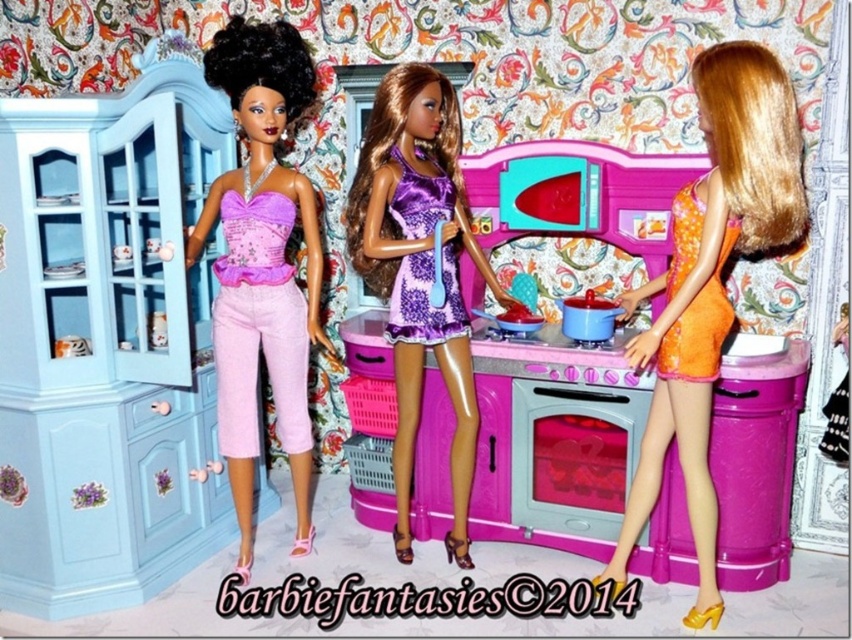
Question: Can you confirm if purple satin dress at center is thinner than matte pink pot at center?

Choices:
 (A) yes
 (B) no

Answer: (B)

Question: Considering the real-world distances, which object is farthest from the purple satin dress at center?

Choices:
 (A) matte pink pot at center
 (B) matte purple fabric dress at center
 (C) pink glossy oven at center

Answer: (A)

Question: Based on their relative distances, which object is nearer to the orange satin dress at center?

Choices:
 (A) pink glossy oven at center
 (B) matte purple fabric dress at center
 (C) matte pink pot at center

Answer: (A)

Question: Which point appears closest to the camera in this image?

Choices:
 (A) (617, 483)
 (B) (433, 196)

Answer: (B)

Question: Is matte purple fabric dress at center further to camera compared to matte pink pot at center?

Choices:
 (A) no
 (B) yes

Answer: (A)

Question: Does purple satin dress at center have a lesser width compared to matte white plate at left?

Choices:
 (A) no
 (B) yes

Answer: (A)